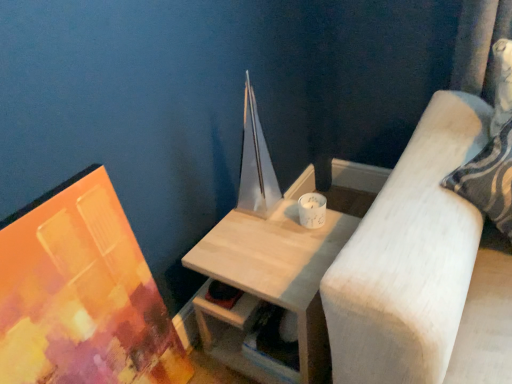
What do you see at coordinates (278, 267) in the screenshot? I see `light wood table at center` at bounding box center [278, 267].

Where is `white ceramic candle at upper right`? The image size is (512, 384). white ceramic candle at upper right is located at coordinates click(x=312, y=210).

Where is `matte acrylic painting at left`? This screenshot has height=384, width=512. matte acrylic painting at left is located at coordinates [x=82, y=294].

Which is in front, point (10, 314) or point (315, 219)?

Point (10, 314)

Considering the sizes of objects matte acrylic painting at left and white ceramic candle at upper right in the image provided, who is smaller, matte acrylic painting at left or white ceramic candle at upper right?

With smaller size is white ceramic candle at upper right.

Is matte acrylic painting at left not near white ceramic candle at upper right?

Actually, matte acrylic painting at left and white ceramic candle at upper right are a little close together.

Is matte acrylic painting at left in front of or behind white ceramic candle at upper right in the image?

Visually, matte acrylic painting at left is located in front of white ceramic candle at upper right.

In terms of size, does matte acrylic painting at left appear bigger or smaller than light wood table at center?

Clearly, matte acrylic painting at left is smaller in size than light wood table at center.

Does matte acrylic painting at left turn towards light wood table at center?

No, matte acrylic painting at left is not aimed at light wood table at center.

From a real-world perspective, is matte acrylic painting at left located beneath light wood table at center?

No, from a real-world perspective, matte acrylic painting at left is not below light wood table at center.

Considering the sizes of objects matte acrylic painting at left and light wood table at center in the image provided, who is wider, matte acrylic painting at left or light wood table at center?

Wider between the two is light wood table at center.

Consider the image. In the image, is light wood table at center positioned in front of or behind matte acrylic painting at left?

In the image, light wood table at center appears behind matte acrylic painting at left.

Is matte acrylic painting at left located within light wood table at center?

No, matte acrylic painting at left is not surrounded by light wood table at center.

In the scene shown: Does light wood table at center have a greater height compared to white ceramic candle at upper right?

Correct, light wood table at center is much taller as white ceramic candle at upper right.

From a real-world perspective, who is located higher, light wood table at center or white ceramic candle at upper right?

white ceramic candle at upper right is physically above.

Is light wood table at center outside of white ceramic candle at upper right?

Indeed, light wood table at center is completely outside white ceramic candle at upper right.

Based on the photo, is white ceramic candle at upper right positioned in front of light wood table at center?

No.

Looking at this image, from the image's perspective, is white ceramic candle at upper right positioned above or below light wood table at center?

From the image's perspective, white ceramic candle at upper right appears above light wood table at center.

Which is in front, point (305, 213) or point (267, 230)?

The point (305, 213) is closer.

In terms of size, does white ceramic candle at upper right appear bigger or smaller than matte acrylic painting at left?

In the image, white ceramic candle at upper right appears to be smaller than matte acrylic painting at left.

Does point (308, 220) appear closer or farther from the camera than point (7, 251)?

Point (308, 220).

Does white ceramic candle at upper right contain matte acrylic painting at left?

That's incorrect, matte acrylic painting at left is not inside white ceramic candle at upper right.

At what (x,y) coordinates should I click in order to perform the action: click on picture frame below the white ceramic candle at upper right (from the image's perspective). Please return your answer as a coordinate pair (x, y). The width and height of the screenshot is (512, 384). Looking at the image, I should click on (82, 294).

Where is `picture frame that appears below the white ceramic candle at upper right (from the image's perspective)`? The image size is (512, 384). picture frame that appears below the white ceramic candle at upper right (from the image's perspective) is located at coordinates (82, 294).

Where is `table to the right of matte acrylic painting at left`? This screenshot has width=512, height=384. table to the right of matte acrylic painting at left is located at coordinates (278, 267).

From the image, which object appears to be nearer to light wood table at center, matte acrylic painting at left or white ceramic candle at upper right?

white ceramic candle at upper right is closer to light wood table at center.

Considering their positions, is white ceramic candle at upper right positioned closer to light wood table at center than matte acrylic painting at left?

The object closer to light wood table at center is white ceramic candle at upper right.

When comparing their distances from white ceramic candle at upper right, does matte acrylic painting at left or light wood table at center seem closer?

Among the two, light wood table at center is located nearer to white ceramic candle at upper right.

Looking at the image, which one is located closer to matte acrylic painting at left, light wood table at center or white ceramic candle at upper right?

light wood table at center is positioned closer to the anchor matte acrylic painting at left.

When comparing their distances from matte acrylic painting at left, does white ceramic candle at upper right or light wood table at center seem closer?

light wood table at center lies closer to matte acrylic painting at left than the other object.

Looking at the image, which one is located further to white ceramic candle at upper right, light wood table at center or matte acrylic painting at left?

matte acrylic painting at left lies further to white ceramic candle at upper right than the other object.

At what (x,y) coordinates should I click in order to perform the action: click on table located between matte acrylic painting at left and white ceramic candle at upper right in the left-right direction. Please return your answer as a coordinate pair (x, y). The height and width of the screenshot is (384, 512). Looking at the image, I should click on (278, 267).